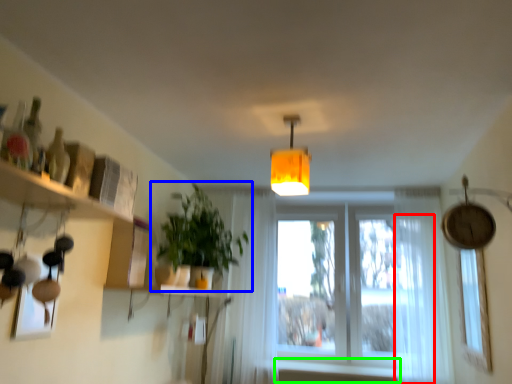
Question: Which object is the closest to the curtain (highlighted by a red box)? Choose among these: houseplant (highlighted by a blue box) or window sill (highlighted by a green box).

Choices:
 (A) houseplant
 (B) window sill

Answer: (B)